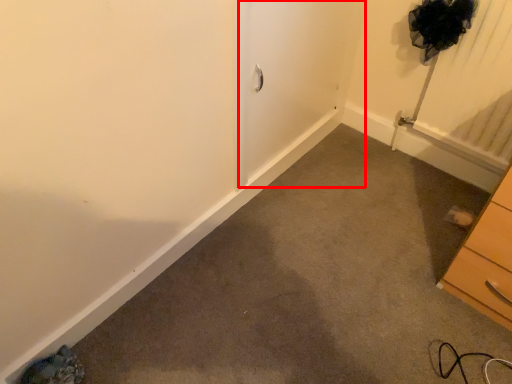
Question: In this image, where is screen door (annotated by the red box) located relative to chest of drawers?

Choices:
 (A) left
 (B) right

Answer: (A)